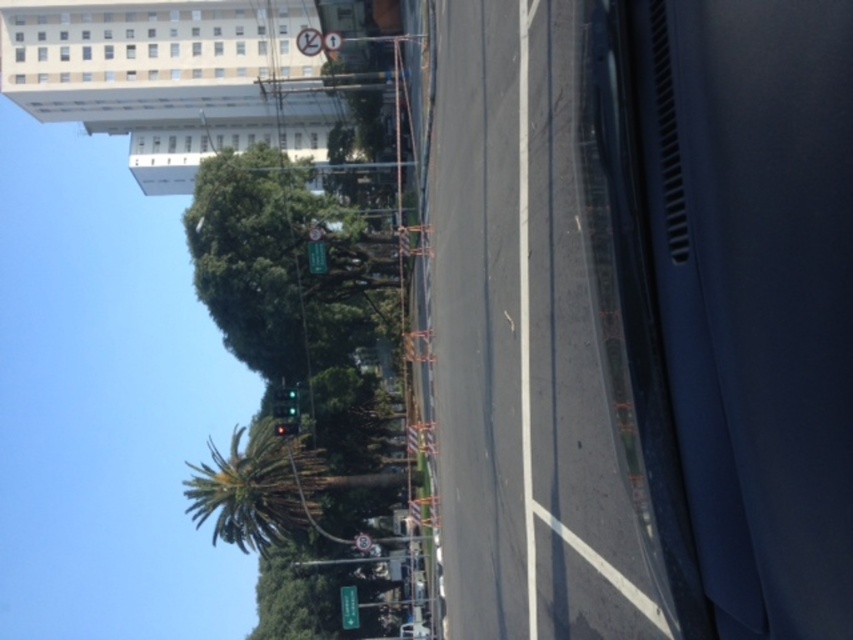
You are a pedestrian standing at the crosswalk. You see the green leafy palm tree at center and the green glass traffic light at upper center. Which object is closer to you?

The green leafy palm tree at center is closer to you because it is positioned in front of the green glass traffic light at upper center.